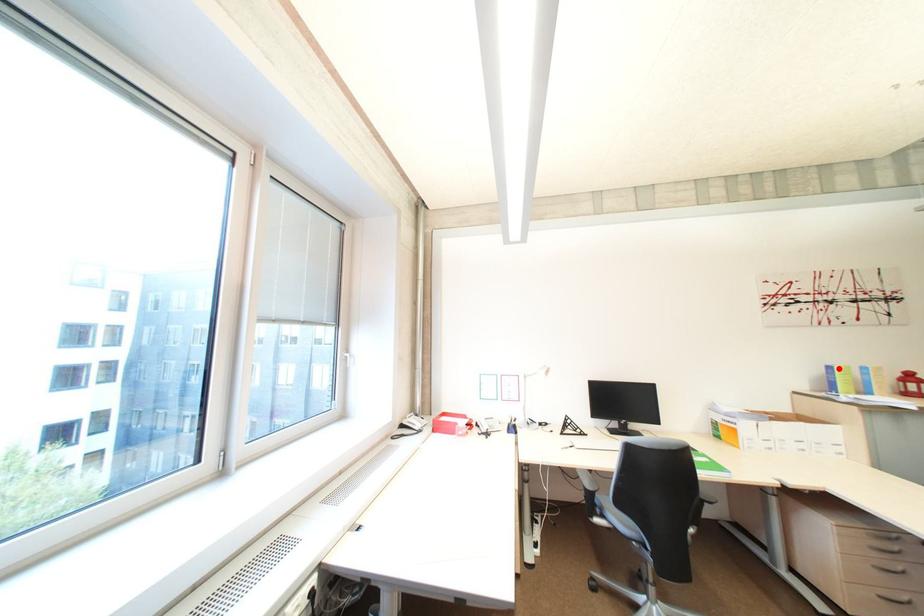
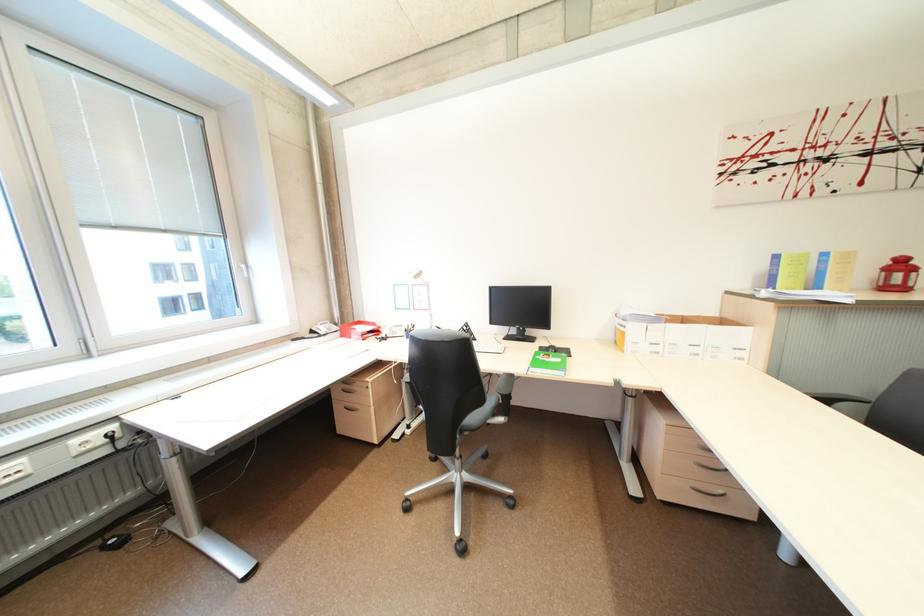
In the second image, find the point that corresponds to the highlighted location in the first image.

(785, 257)